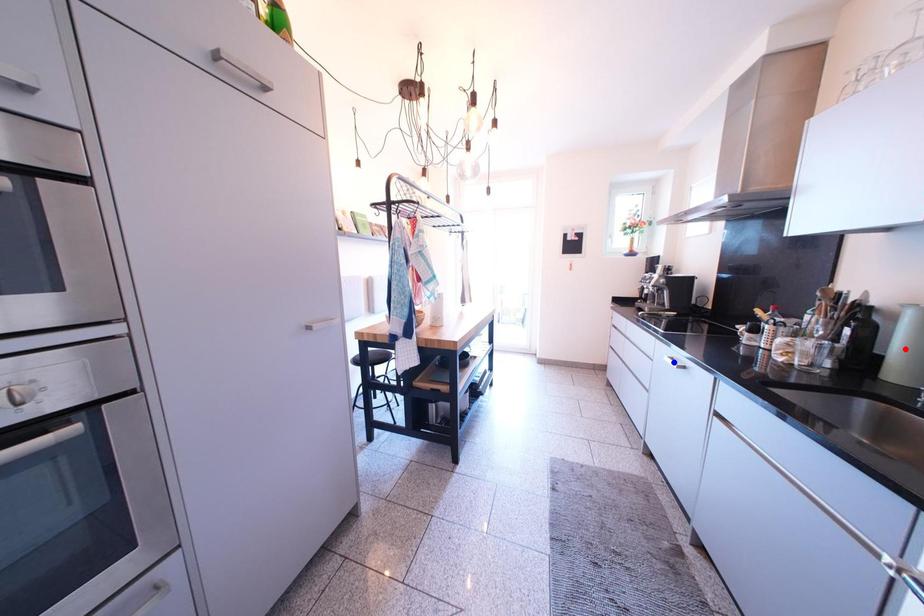
Question: Two points are marked on the image. Which point is closer to the camera?

Choices:
 (A) Blue point is closer.
 (B) Red point is closer.

Answer: (B)